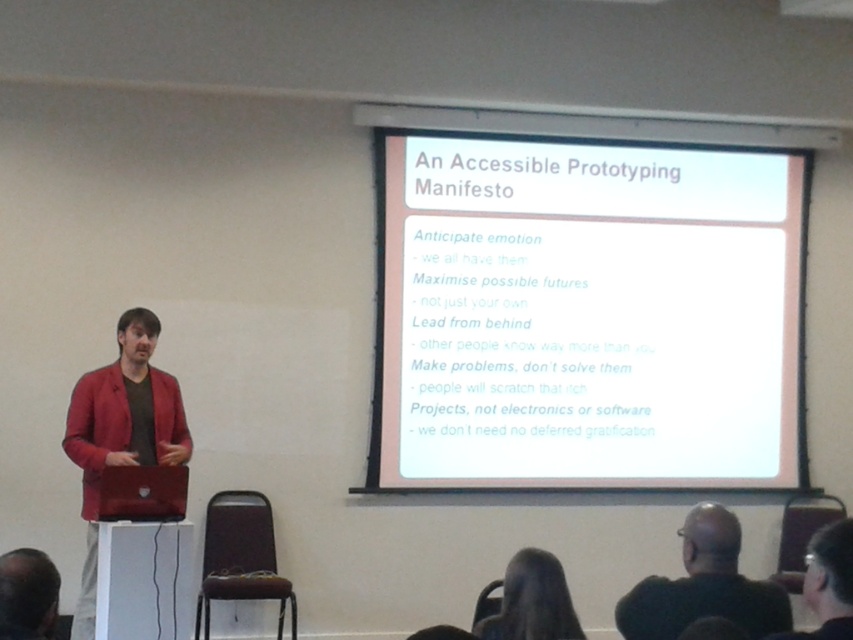
Question: Estimate the real-world distances between objects in this image. Which object is farther from the dark hair at lower center?

Choices:
 (A) dark green sweater at lower right
 (B) dark brown hair at lower left
 (C) matte red jacket at left

Answer: (C)

Question: Which of the following is the farthest from the observer?

Choices:
 (A) (123, 358)
 (B) (677, 586)
 (C) (45, 572)

Answer: (A)

Question: Is matte red jacket at left to the left of dark hair at lower center from the viewer's perspective?

Choices:
 (A) no
 (B) yes

Answer: (B)

Question: Is white paper at upper center positioned at the back of dark hair at lower center?

Choices:
 (A) yes
 (B) no

Answer: (A)

Question: Is white paper at upper center closer to camera compared to matte red jacket at left?

Choices:
 (A) no
 (B) yes

Answer: (A)

Question: Among these objects, which one is farthest from the camera?

Choices:
 (A) dark brown hair at lower left
 (B) dark hair at lower center
 (C) dark green sweater at lower right
 (D) matte red jacket at left

Answer: (D)